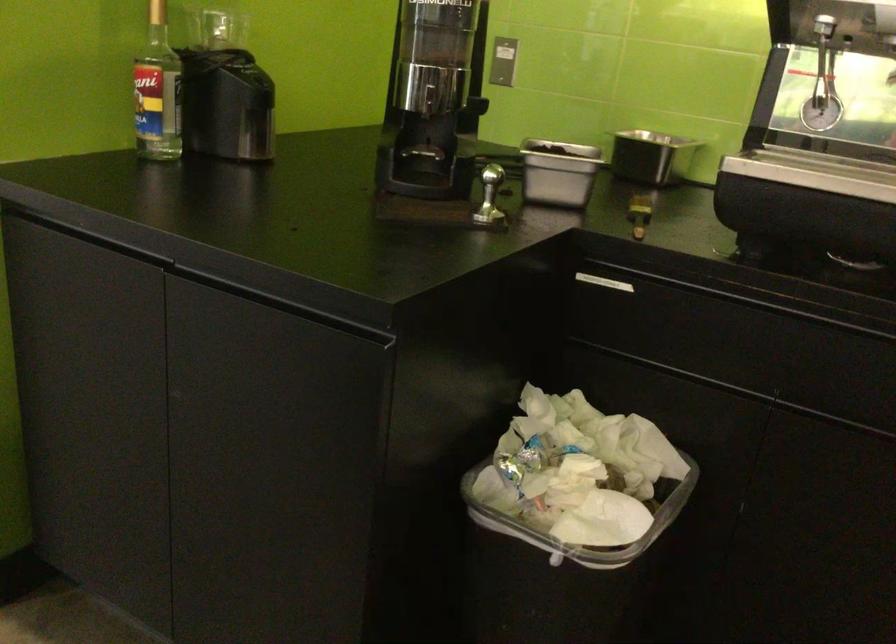
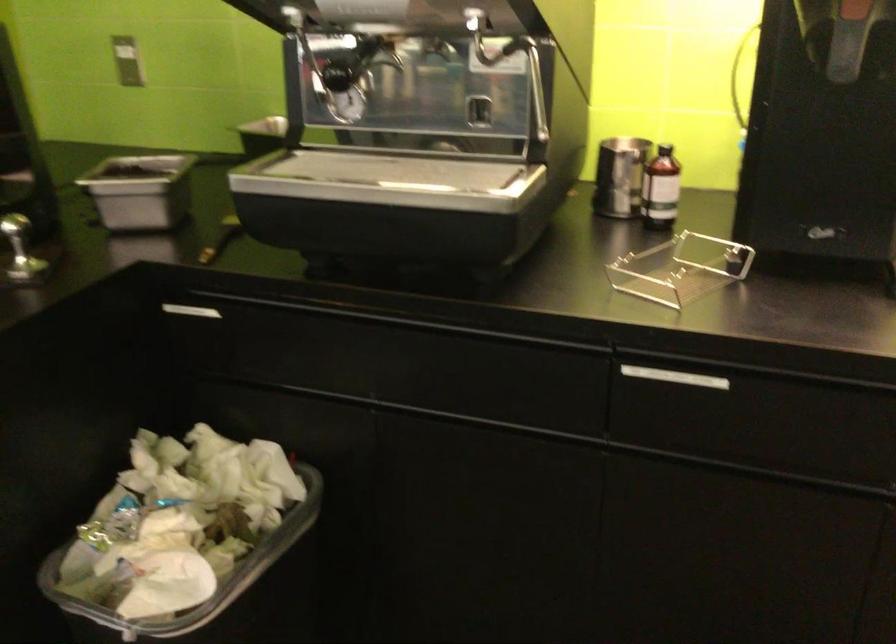
Where in the second image is the point corresponding to [639,542] from the first image?

(218, 592)